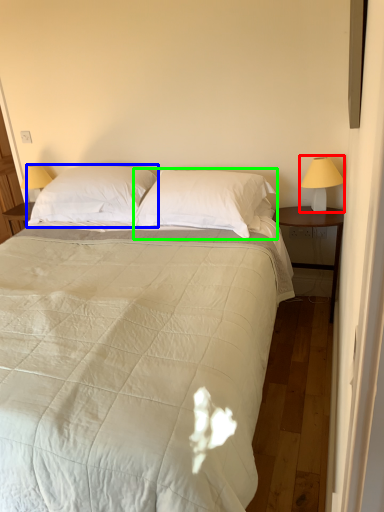
Question: Which object is the farthest from bedside lamp (highlighted by a red box)? Choose among these: pillow (highlighted by a blue box) or pillow (highlighted by a green box).

Choices:
 (A) pillow
 (B) pillow

Answer: (A)